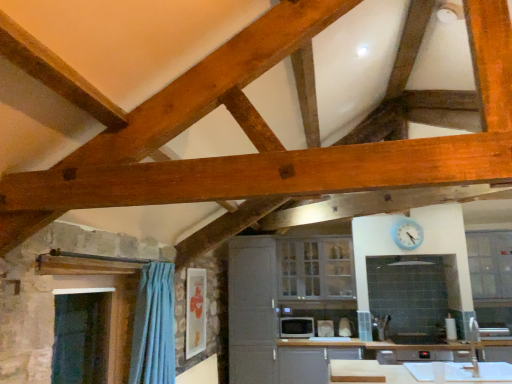
Measure the distance between white glossy cabinet at center, which is counted as the 2th cabinetry, starting from the left, and camera.

The distance of white glossy cabinet at center, which is counted as the 2th cabinetry, starting from the left, from camera is 5.75 meters.

Locate an element on the screen. This screenshot has height=384, width=512. white glossy microwave at center, the 2th appliance from the left is located at coordinates (325, 328).

The width and height of the screenshot is (512, 384). Describe the element at coordinates (325, 328) in the screenshot. I see `white glossy microwave at center, the 2th appliance from the left` at that location.

Image resolution: width=512 pixels, height=384 pixels. Describe the element at coordinates (490, 264) in the screenshot. I see `clear glass window at upper right` at that location.

What do you see at coordinates (80, 338) in the screenshot?
I see `transparent plastic window screen at left` at bounding box center [80, 338].

This screenshot has width=512, height=384. What are the coordinates of `white glossy cabinet at center, which is counted as the 2th cabinetry, starting from the left` in the screenshot? It's located at (316, 268).

Which is in front, point (290, 325) or point (314, 286)?

The point (290, 325) is more forward.

Is matte black microwave at center, the first appliance viewed from the left, not within white glossy cabinet at center, positioned as the 1th cabinetry in right-to-left order?

Yes.

From the image's perspective, is matte black microwave at center, the second appliance from the right, above or below white glossy cabinet at center, positioned as the 1th cabinetry in right-to-left order?

Based on their image positions, matte black microwave at center, the second appliance from the right, is located beneath white glossy cabinet at center, positioned as the 1th cabinetry in right-to-left order.

Is clear glass window at upper right smaller than blue plastic clock at upper center?

Incorrect, clear glass window at upper right is not smaller in size than blue plastic clock at upper center.

From a real-world perspective, is clear glass window at upper right below blue plastic clock at upper center?

Yes, from a real-world perspective, clear glass window at upper right is below blue plastic clock at upper center.

Which is in front, point (492, 248) or point (406, 246)?

The point (492, 248) is closer to the camera.

From the image's perspective, who appears lower, clear glass window at upper right or blue plastic clock at upper center?

clear glass window at upper right is shown below in the image.

Is white glossy microwave at center, which ranks as the first appliance in right-to-left order, facing towards clear glass window at upper right?

No, white glossy microwave at center, which ranks as the first appliance in right-to-left order, is not aimed at clear glass window at upper right.

Would you say clear glass window at upper right is part of white glossy microwave at center, the 2th appliance from the left,'s contents?

No, clear glass window at upper right is not a part of white glossy microwave at center, the 2th appliance from the left.

Which is more to the right, white glossy microwave at center, which ranks as the first appliance in right-to-left order, or clear glass window at upper right?

Result: clear glass window at upper right is more to the right.

Looking at this image, measure the distance from white glossy microwave at center, which ranks as the first appliance in right-to-left order, to clear glass window at upper right.

white glossy microwave at center, which ranks as the first appliance in right-to-left order, and clear glass window at upper right are 2.44 meters apart.

Which object is positioned more to the left, blue plastic clock at upper center or clear glass window at upper right?

blue plastic clock at upper center.

Is point (398, 240) farther from viewer compared to point (477, 253)?

Yes, point (398, 240) is behind point (477, 253).

You are a GUI agent. You are given a task and a screenshot of the screen. Output one action in this format:
    pyautogui.click(x=<x>, y=<y>)
    Task: Click on the clock lying behind the clear glass window at upper right
    
    Given the screenshot: What is the action you would take?
    pyautogui.click(x=407, y=234)

From the image's perspective, does blue plastic clock at upper center appear higher than clear glass window at upper right?

Yes, from the image's perspective, blue plastic clock at upper center is on top of clear glass window at upper right.

Is white glossy cabinet at center, which is counted as the 2th cabinetry, starting from the left, taller than white glossy microwave at center, the 2th appliance from the left?

Yes.

Is white glossy cabinet at center, positioned as the 1th cabinetry in right-to-left order, positioned behind white glossy microwave at center, which ranks as the first appliance in right-to-left order?

No, it is not.

Identify the location of the 1st cabinetry in front of the white glossy microwave at center, which ranks as the first appliance in right-to-left order. click(316, 268).

Which is more to the left, white glossy cabinet at center, positioned as the 1th cabinetry in right-to-left order, or white glossy microwave at center, which ranks as the first appliance in right-to-left order?

From the viewer's perspective, white glossy cabinet at center, positioned as the 1th cabinetry in right-to-left order, appears more on the left side.

Based on their sizes in the image, would you say white glossy cabinet at center, acting as the 2th cabinetry starting from the right, is bigger or smaller than transparent plastic window screen at left?

Considering their sizes, white glossy cabinet at center, acting as the 2th cabinetry starting from the right, takes up more space than transparent plastic window screen at left.

Considering the positions of objects white glossy cabinet at center, the first cabinetry in the left-to-right sequence, and transparent plastic window screen at left in the image provided, who is more to the right, white glossy cabinet at center, the first cabinetry in the left-to-right sequence, or transparent plastic window screen at left?

From the viewer's perspective, white glossy cabinet at center, the first cabinetry in the left-to-right sequence, appears more on the right side.

Relative to transparent plastic window screen at left, is white glossy cabinet at center, the first cabinetry in the left-to-right sequence, in front or behind?

white glossy cabinet at center, the first cabinetry in the left-to-right sequence, is positioned farther from the viewer than transparent plastic window screen at left.

Which of these two, matte black microwave at center, the first appliance viewed from the left, or blue plastic clock at upper center, is thinner?

With smaller width is blue plastic clock at upper center.

Is point (302, 319) closer or farther from the camera than point (416, 230)?

Point (302, 319) appears to be farther away from the viewer than point (416, 230).

Is matte black microwave at center, the first appliance viewed from the left, turned away from blue plastic clock at upper center?

No, matte black microwave at center, the first appliance viewed from the left, is not facing away from blue plastic clock at upper center.

From the picture: Can you confirm if matte black microwave at center, the first appliance viewed from the left, is bigger than blue plastic clock at upper center?

Indeed, matte black microwave at center, the first appliance viewed from the left, has a larger size compared to blue plastic clock at upper center.

You are a GUI agent. You are given a task and a screenshot of the screen. Output one action in this format:
    pyautogui.click(x=<x>, y=<y>)
    Task: Click on the 1st cabinetry in front when counting from the matte black microwave at center, the second appliance from the right
    This screenshot has width=512, height=384.
    Given the screenshot: What is the action you would take?
    pyautogui.click(x=316, y=268)

This screenshot has height=384, width=512. Identify the location of window that appears below the blue plastic clock at upper center (from the image's perspective). (490, 264).

Estimate the real-world distances between objects in this image. Which object is closer to blue plastic clock at upper center, white glossy cabinet at center, the first cabinetry in the left-to-right sequence, or white glossy microwave at center, which ranks as the first appliance in right-to-left order?

Among the two, white glossy microwave at center, which ranks as the first appliance in right-to-left order, is located nearer to blue plastic clock at upper center.

Considering their positions, is white glossy cabinet at center, positioned as the 1th cabinetry in right-to-left order, positioned closer to blue plastic clock at upper center than clear glass window at upper right?

The object closer to blue plastic clock at upper center is clear glass window at upper right.

Which object lies nearer to the anchor point clear glass window at upper right, matte black microwave at center, the first appliance viewed from the left, or transparent plastic window screen at left?

matte black microwave at center, the first appliance viewed from the left, is positioned closer to the anchor clear glass window at upper right.

From the image, which object appears to be farther from white glossy cabinet at center, positioned as the 1th cabinetry in right-to-left order, blue plastic clock at upper center or white glossy cabinet at center, acting as the 2th cabinetry starting from the right?

blue plastic clock at upper center lies further to white glossy cabinet at center, positioned as the 1th cabinetry in right-to-left order, than the other object.

Based on their spatial positions, is white glossy cabinet at center, positioned as the 1th cabinetry in right-to-left order, or transparent plastic window screen at left closer to matte black microwave at center, the first appliance viewed from the left?

white glossy cabinet at center, positioned as the 1th cabinetry in right-to-left order.

Considering their positions, is white glossy microwave at center, the 2th appliance from the left, positioned further to white glossy cabinet at center, which is counted as the 2th cabinetry, starting from the left, than white glossy cabinet at center, acting as the 2th cabinetry starting from the right?

white glossy microwave at center, the 2th appliance from the left, lies further to white glossy cabinet at center, which is counted as the 2th cabinetry, starting from the left, than the other object.

From the picture: Looking at the image, which one is located closer to white glossy microwave at center, which ranks as the first appliance in right-to-left order, white glossy cabinet at center, which is counted as the 2th cabinetry, starting from the left, or clear glass window at upper right?

white glossy cabinet at center, which is counted as the 2th cabinetry, starting from the left, is positioned closer to the anchor white glossy microwave at center, which ranks as the first appliance in right-to-left order.

From the image, which object appears to be nearer to white glossy cabinet at center, acting as the 2th cabinetry starting from the right, blue plastic clock at upper center or transparent plastic window screen at left?

blue plastic clock at upper center is closer to white glossy cabinet at center, acting as the 2th cabinetry starting from the right.

Locate an element on the screen. This screenshot has width=512, height=384. clock situated between matte black microwave at center, the second appliance from the right, and clear glass window at upper right from left to right is located at coordinates (407, 234).

In order to click on clock located between transparent plastic window screen at left and matte black microwave at center, the first appliance viewed from the left, in the depth direction in this screenshot , I will do `click(407, 234)`.

Locate an element on the screen. The width and height of the screenshot is (512, 384). clock between transparent plastic window screen at left and white glossy microwave at center, the 2th appliance from the left, along the z-axis is located at coordinates (407, 234).

Identify the location of cabinetry between matte black microwave at center, the second appliance from the right, and clear glass window at upper right, in the horizontal direction. (316, 268).